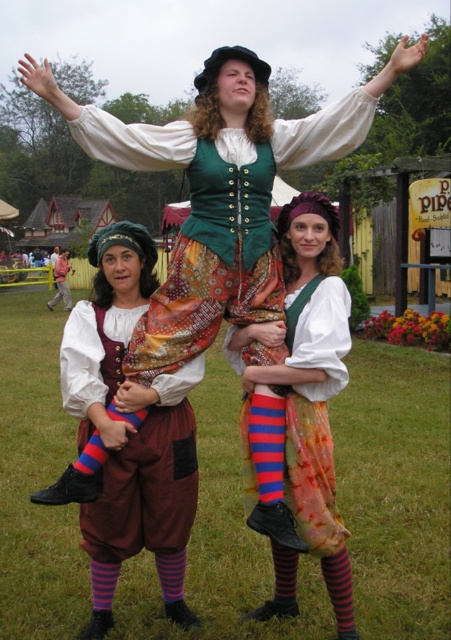
Looking at the central figure in the Renaissance fair scene, which object is positioned higher on her body between the matte green fabric vest at center and the matte brown leather belt at center?

The matte green fabric vest at center is positioned higher on her body than the matte brown leather belt at center.

You are a costume designer preparing to create a replica of the central figure from the Renaissance fair scene. You need to ensure the matte brown leather skirt at center and the matte white blouse at center are positioned correctly. Based on the spacing between them, can you determine if they are close enough to be worn together as part of the same outfit?

The matte brown leather skirt at center is 26.36 inches from matte white blouse at center. Since this distance is typical for the separation between a blouse and skirt in clothing, they can be worn together as part of the same outfit.